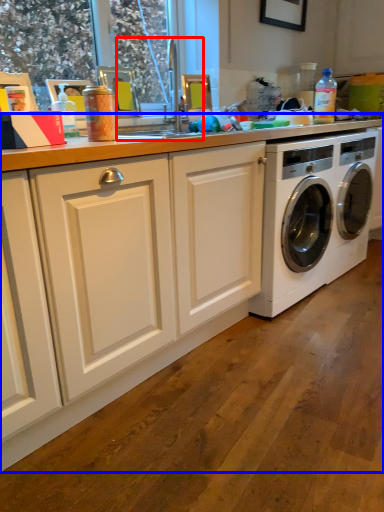
Question: Which object is further to the camera taking this photo, sink (highlighted by a red box) or countertop (highlighted by a blue box)?

Choices:
 (A) sink
 (B) countertop

Answer: (A)